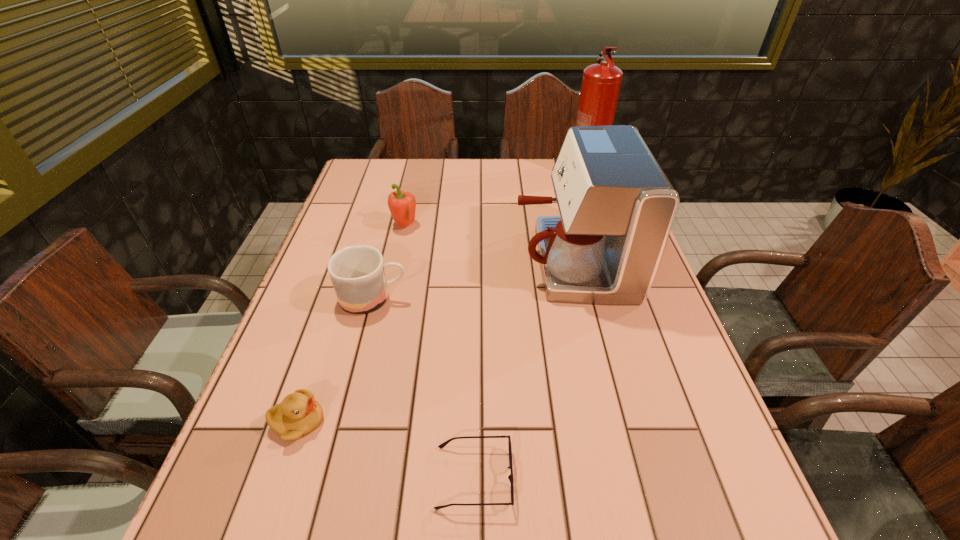
Where is `empty location between the pepper and the coffee maker`? This screenshot has height=540, width=960. empty location between the pepper and the coffee maker is located at coordinates (489, 244).

Locate which object is the closest to the tallest object. Please provide its 2D coordinates. Your answer should be formatted as a tuple, i.e. [(x, y)], where the tuple contains the x and y coordinates of a point satisfying the conditions above.

[(617, 207)]

Identify which object is the fifth closest to the fifth shortest object. Please provide its 2D coordinates. Your answer should be formatted as a tuple, i.e. [(x, y)], where the tuple contains the x and y coordinates of a point satisfying the conditions above.

[(299, 414)]

Identify the location of vacant space that satisfies the following two spatial constraints: 1. on the handle side the tallest object; 2. on the front-facing side of the spectacles. This screenshot has height=540, width=960. (694, 477).

This screenshot has width=960, height=540. Find the location of `free space that satisfies the following two spatial constraints: 1. on the handle side the tallest object; 2. at the beak of the duckling`. free space that satisfies the following two spatial constraints: 1. on the handle side the tallest object; 2. at the beak of the duckling is located at coordinates (675, 422).

Identify the location of free space that satisfies the following two spatial constraints: 1. on the handle side the tallest object; 2. on the front of the fifth shortest object near the spout. This screenshot has width=960, height=540. (x=616, y=261).